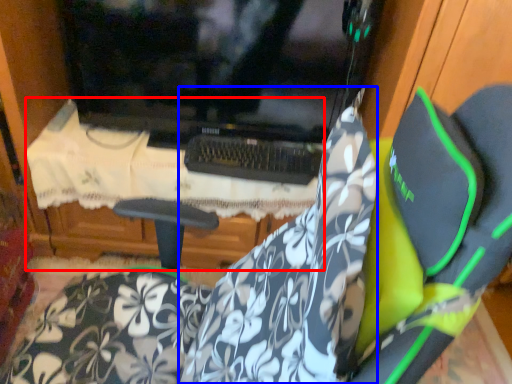
Question: Which of the following is the closest to the observer, table (highlighted by a red box) or fabric (highlighted by a blue box)?

Choices:
 (A) table
 (B) fabric

Answer: (B)